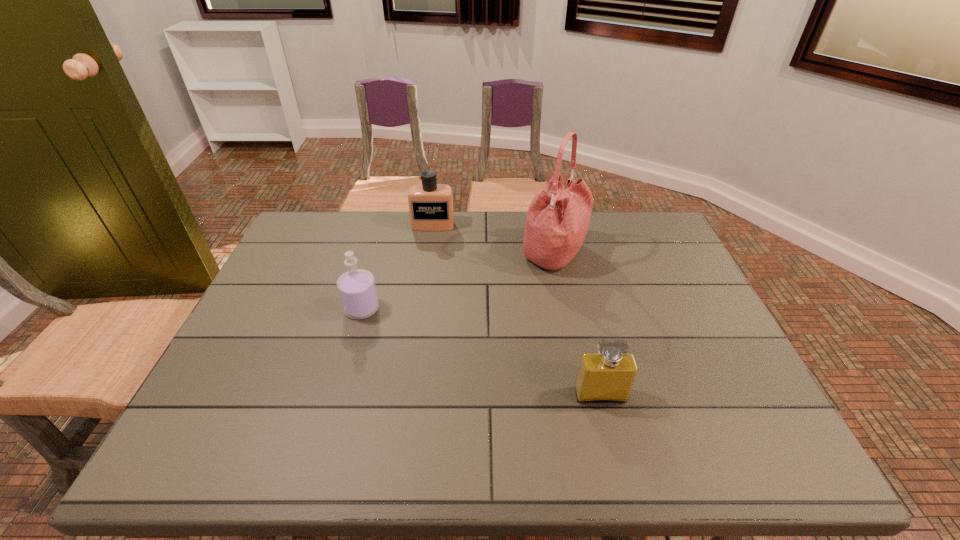
At what (x,y) coordinates should I click in order to perform the action: click on vacant space that's between the second nearest object and the handbag. Please return your answer as a coordinate pair (x, y). The width and height of the screenshot is (960, 540). Looking at the image, I should click on (458, 281).

You are a GUI agent. You are given a task and a screenshot of the screen. Output one action in this format:
    pyautogui.click(x=<x>, y=<y>)
    Task: Click on the object that is the nearest to the nearest object
    
    Given the screenshot: What is the action you would take?
    pyautogui.click(x=557, y=221)

Identify which object is the closest to the farthest perfume. Please provide its 2D coordinates. Your answer should be formatted as a tuple, i.e. [(x, y)], where the tuple contains the x and y coordinates of a point satisfying the conditions above.

[(557, 221)]

Choose which perfume is the third nearest neighbor to the second farthest object. Please provide its 2D coordinates. Your answer should be formatted as a tuple, i.e. [(x, y)], where the tuple contains the x and y coordinates of a point satisfying the conditions above.

[(357, 290)]

Find the location of `perfume that is the second closest to the rightmost perfume`. perfume that is the second closest to the rightmost perfume is located at coordinates (430, 204).

Where is `free point that satisfies the following two spatial constraints: 1. on the front label of the farthest perfume; 2. on the right side of the third nearest object`? This screenshot has width=960, height=540. free point that satisfies the following two spatial constraints: 1. on the front label of the farthest perfume; 2. on the right side of the third nearest object is located at coordinates (429, 254).

At what (x,y) coordinates should I click in order to perform the action: click on vacant space that satisfies the following two spatial constraints: 1. on the front label of the farthest perfume; 2. on the right side of the third nearest object. Please return your answer as a coordinate pair (x, y). Looking at the image, I should click on (429, 254).

I want to click on blank area in the image that satisfies the following two spatial constraints: 1. on the front label of the tallest object; 2. on the left side of the farthest object, so 429,254.